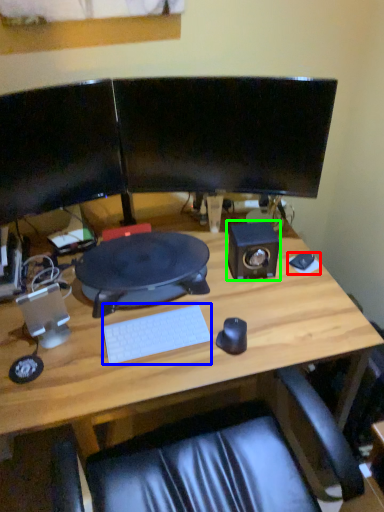
Question: Which object is the farthest from mousepad (highlighted by a red box)? Choose among these: computer keyboard (highlighted by a blue box) or speaker (highlighted by a green box).

Choices:
 (A) computer keyboard
 (B) speaker

Answer: (A)